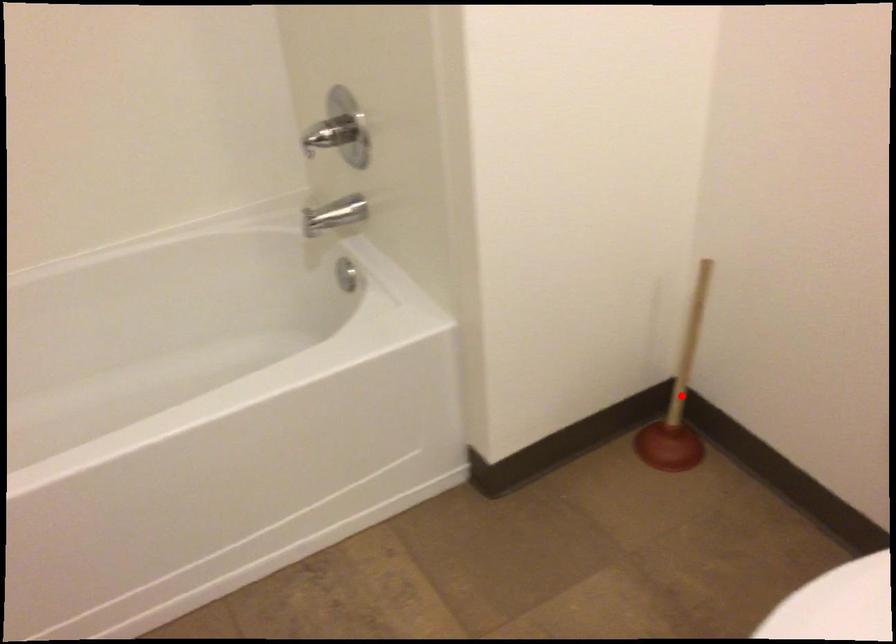
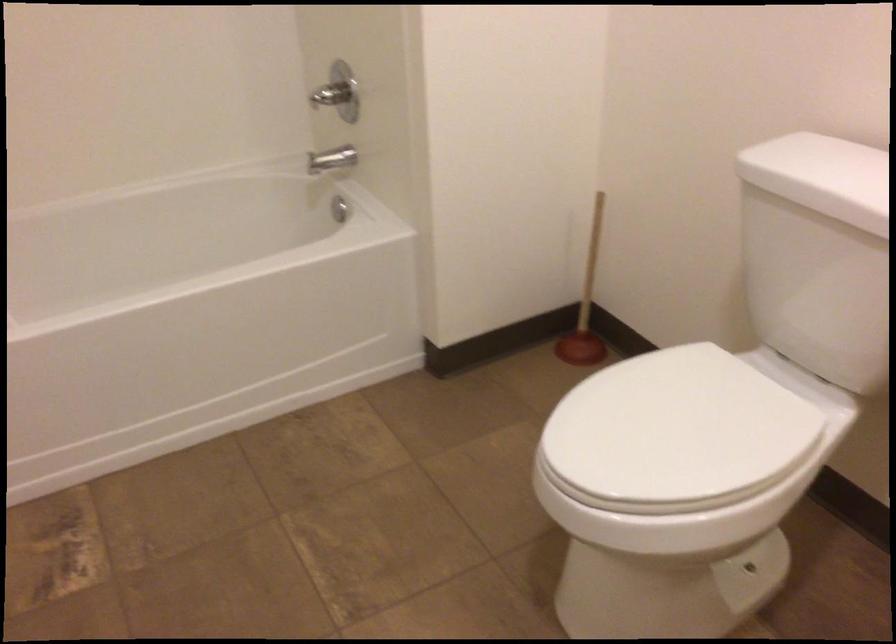
Where in the second image is the point corresponding to the highlighted location from the first image?

(586, 305)